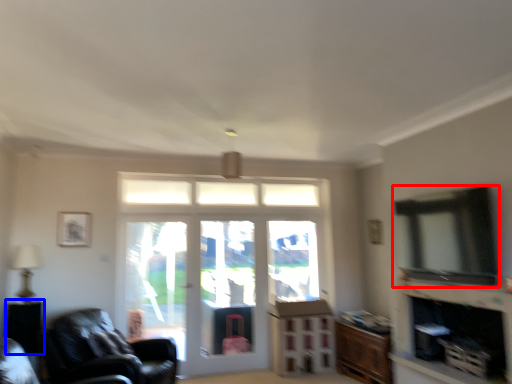
Question: Which point is closer to the camera, window (highlighted by a red box) or side table (highlighted by a blue box)?

Choices:
 (A) window
 (B) side table

Answer: (A)